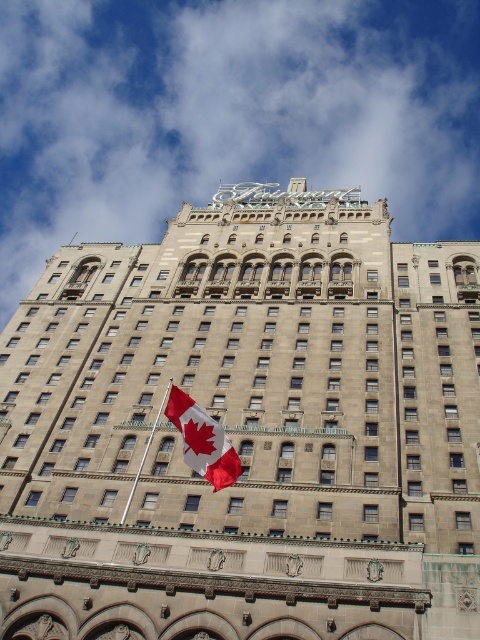
Question: Can you confirm if stone textured building at center is wider than red and white fabric flag at center?

Choices:
 (A) yes
 (B) no

Answer: (A)

Question: Considering the real-world distances, which object is farthest from the metallic flag pole at center?

Choices:
 (A) red and white fabric flag at center
 (B) stone textured building at center

Answer: (B)

Question: Considering the relative positions of stone textured building at center and red and white fabric flag at center in the image provided, where is stone textured building at center located with respect to red and white fabric flag at center?

Choices:
 (A) left
 (B) right

Answer: (B)

Question: Which object appears closest to the camera in this image?

Choices:
 (A) stone textured building at center
 (B) red and white fabric flag at center

Answer: (A)

Question: Is the position of red and white fabric flag at center more distant than that of metallic flag pole at center?

Choices:
 (A) yes
 (B) no

Answer: (B)

Question: Which point is farther to the camera?

Choices:
 (A) metallic flag pole at center
 (B) red and white fabric flag at center
 (C) stone textured building at center

Answer: (A)